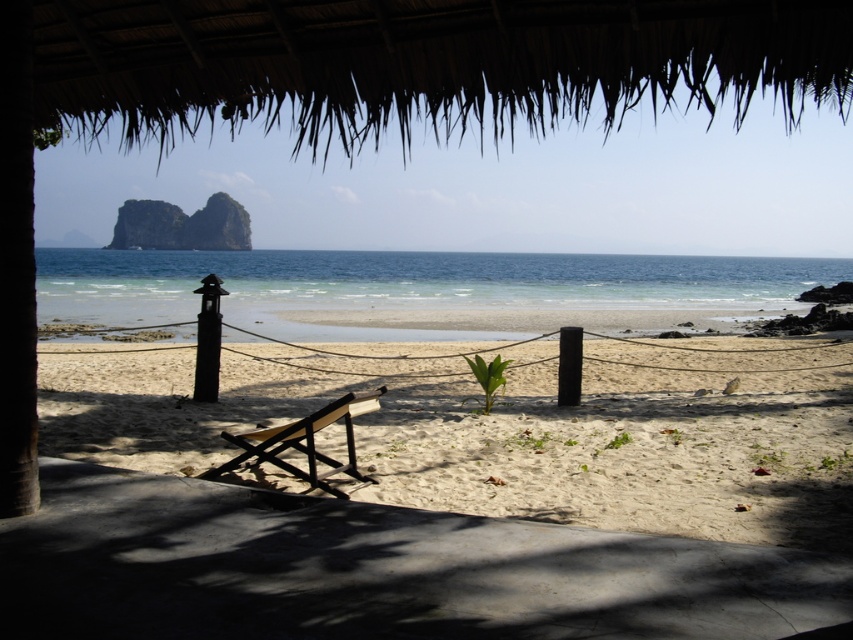
You are sitting on the wooden chair at center and want to reach the black matte pole at center to tie your kite string. Which direction should you move to get closer to the pole?

The wooden chair at center is located below the black matte pole at center, so you should move upward to reach the black matte pole at center.

You are standing under the thatched roof structure and want to walk to the ocean. You see the light beige sand at center and the black matte pole at center. Which object is closer to the ocean?

The light beige sand at center is closer to the ocean because it is located below the black matte pole at center, meaning it is positioned further out towards the water.